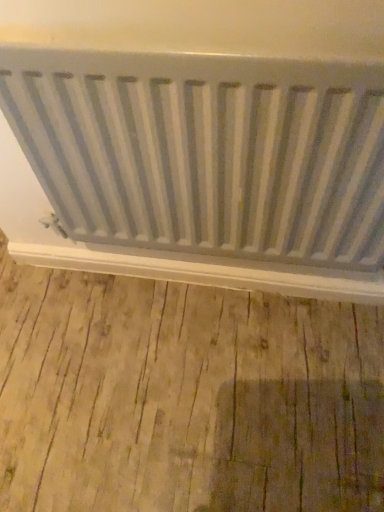
Locate an element on the screen. white matte radiator at center is located at coordinates (206, 152).

What do you see at coordinates (206, 152) in the screenshot?
I see `white matte radiator at center` at bounding box center [206, 152].

Looking at this image, in order to face white matte radiator at center, should I rotate leftwards or rightwards?

Turn right approximately 2.245 degrees to face it.

What are the coordinates of `white matte radiator at lower center` in the screenshot? It's located at (199, 273).

Describe the element at coordinates (199, 273) in the screenshot. This screenshot has width=384, height=512. I see `white matte radiator at lower center` at that location.

I want to click on white matte radiator at center, so click(x=206, y=152).

From the picture: Which object is positioned more to the right, white matte radiator at lower center or white matte radiator at center?

From the viewer's perspective, white matte radiator at center appears more on the right side.

Is white matte radiator at lower center closer to the viewer compared to white matte radiator at center?

No, white matte radiator at lower center is further to the viewer.

Between point (11, 253) and point (302, 165), which one is positioned behind?

The point (11, 253) is farther.

From the image's perspective, which object appears higher, white matte radiator at lower center or white matte radiator at center?

From the image's view, white matte radiator at center is above.

From a real-world perspective, which object rests below the other?

white matte radiator at lower center.

In the scene shown: Considering the relative sizes of white matte radiator at lower center and white matte radiator at center in the image provided, is white matte radiator at lower center wider than white matte radiator at center?

In fact, white matte radiator at lower center might be narrower than white matte radiator at center.

Is white matte radiator at lower center taller than white matte radiator at center?

No, white matte radiator at lower center is not taller than white matte radiator at center.

Consider the image. Looking at the image, does white matte radiator at lower center seem bigger or smaller compared to white matte radiator at center?

In the image, white matte radiator at lower center appears to be smaller than white matte radiator at center.

Is white matte radiator at lower center inside the boundaries of white matte radiator at center, or outside?

white matte radiator at lower center is spatially situated outside white matte radiator at center.

Can you see white matte radiator at lower center touching white matte radiator at center?

There is a gap between white matte radiator at lower center and white matte radiator at center.

Does white matte radiator at lower center turn towards white matte radiator at center?

No, white matte radiator at lower center does not turn towards white matte radiator at center.

What's the angular difference between white matte radiator at lower center and white matte radiator at center's facing directions?

The facing directions of white matte radiator at lower center and white matte radiator at center are 0.00417 degrees apart.

This screenshot has height=512, width=384. Identify the location of window sill that is behind the white matte radiator at center. (199, 273).

Considering the relative positions of white matte radiator at center and white matte radiator at lower center in the image provided, is white matte radiator at center to the left of white matte radiator at lower center from the viewer's perspective?

In fact, white matte radiator at center is to the right of white matte radiator at lower center.

Considering the relative positions of white matte radiator at center and white matte radiator at lower center in the image provided, is white matte radiator at center behind white matte radiator at lower center?

No, it is in front of white matte radiator at lower center.

Does point (329, 154) lie behind point (203, 277)?

No, (329, 154) is closer to viewer.

From the image's perspective, is white matte radiator at center located above white matte radiator at lower center?

Yes, from the image's perspective, white matte radiator at center is over white matte radiator at lower center.

From a real-world perspective, which is physically below, white matte radiator at center or white matte radiator at lower center?

From a 3D spatial view, white matte radiator at lower center is below.

Is white matte radiator at center thinner than white matte radiator at lower center?

No, white matte radiator at center is not thinner than white matte radiator at lower center.

Considering the relative sizes of white matte radiator at center and white matte radiator at lower center in the image provided, is white matte radiator at center shorter than white matte radiator at lower center?

Incorrect, the height of white matte radiator at center does not fall short of that of white matte radiator at lower center.

Considering the sizes of objects white matte radiator at center and white matte radiator at lower center in the image provided, who is smaller, white matte radiator at center or white matte radiator at lower center?

white matte radiator at lower center.

Would you say white matte radiator at center is outside white matte radiator at lower center?

white matte radiator at center lies outside white matte radiator at lower center's area.

Is white matte radiator at center next to white matte radiator at lower center and touching it?

No, white matte radiator at center is not touching white matte radiator at lower center.

Is white matte radiator at center oriented towards white matte radiator at lower center?

No, white matte radiator at center is not oriented towards white matte radiator at lower center.

Can you tell me how much white matte radiator at center and white matte radiator at lower center differ in facing direction?

0.00417 degrees separate the facing orientations of white matte radiator at center and white matte radiator at lower center.

Find the location of `window sill behind the white matte radiator at center`. window sill behind the white matte radiator at center is located at coordinates (199, 273).

I want to click on window sill that is behind the white matte radiator at center, so click(x=199, y=273).

You are a GUI agent. You are given a task and a screenshot of the screen. Output one action in this format:
    pyautogui.click(x=<x>, y=<y>)
    Task: Click on the window sill below the white matte radiator at center (from a real-world perspective)
    This screenshot has width=384, height=512.
    Given the screenshot: What is the action you would take?
    pyautogui.click(x=199, y=273)